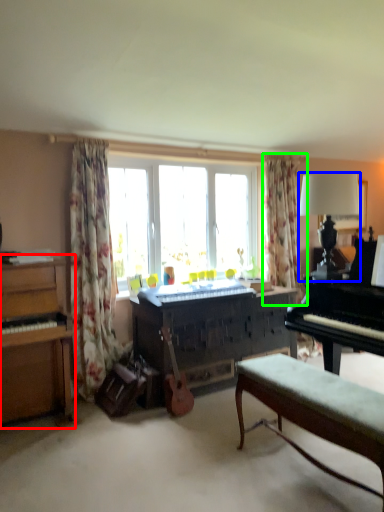
Question: Based on their relative distances, which object is nearer to piano (highlighted by a red box)? Choose from lamp (highlighted by a blue box) and curtain (highlighted by a green box).

Choices:
 (A) lamp
 (B) curtain

Answer: (A)